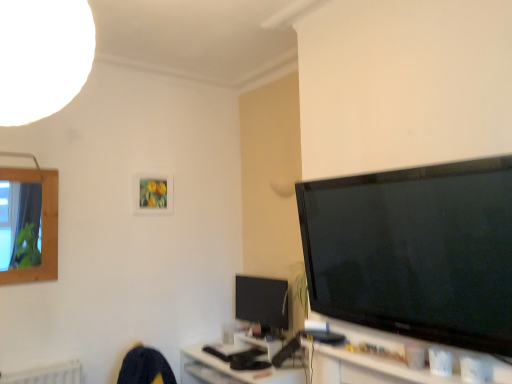
Question: Is wooden frame at left wider or thinner than matte wooden picture frame at upper center?

Choices:
 (A) thin
 (B) wide

Answer: (B)

Question: In the image, is wooden frame at left positioned in front of or behind matte wooden picture frame at upper center?

Choices:
 (A) behind
 (B) front

Answer: (B)

Question: Estimate the real-world distances between objects in this image. Which object is closer to the wooden frame at left?

Choices:
 (A) white glossy tv cabinet at lower right
 (B) black matte keyboard at lower center
 (C) matte black monitor at center
 (D) matte wooden picture frame at upper center

Answer: (D)

Question: Estimate the real-world distances between objects in this image. Which object is farther from the matte black monitor at center?

Choices:
 (A) wooden frame at left
 (B) matte wooden picture frame at upper center
 (C) white glossy tv cabinet at lower right
 (D) black matte keyboard at lower center

Answer: (A)